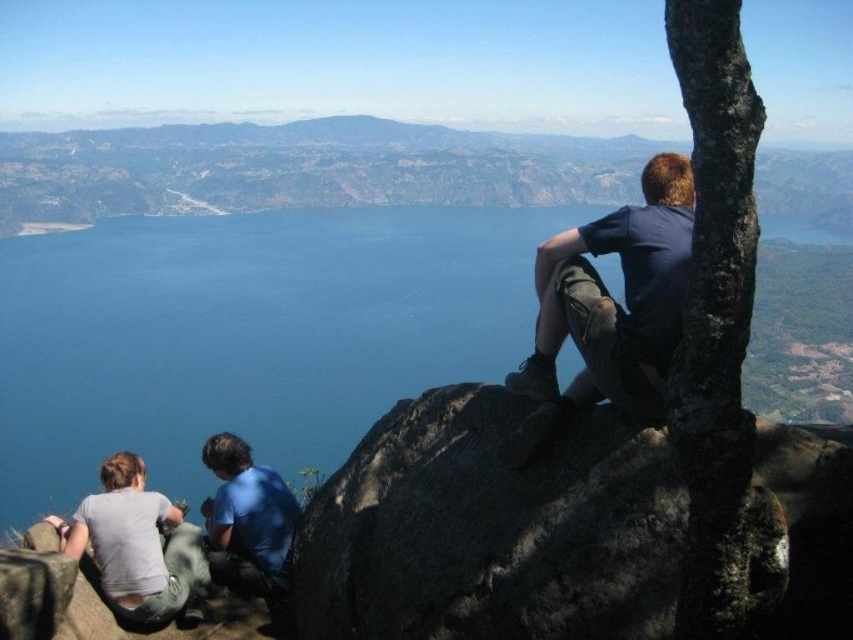
Locate an element on the screen. blue water at center is located at coordinates (245, 336).

Is blue water at center wider than light gray cotton shirt at lower left?

Indeed, blue water at center has a greater width compared to light gray cotton shirt at lower left.

Is point (808, 362) more distant than point (132, 586)?

Yes, it is.

Where is `blue water at center`? blue water at center is located at coordinates (245, 336).

Which of these two, dark blue shirt at upper right or blue matte shirt at lower left, stands shorter?

blue matte shirt at lower left is shorter.

Does dark blue shirt at upper right appear under blue matte shirt at lower left?

Actually, dark blue shirt at upper right is above blue matte shirt at lower left.

You are a GUI agent. You are given a task and a screenshot of the screen. Output one action in this format:
    pyautogui.click(x=<x>, y=<y>)
    Task: Click on the dark blue shirt at upper right
    This screenshot has height=640, width=853.
    Given the screenshot: What is the action you would take?
    pyautogui.click(x=612, y=298)

Can you confirm if dark blue shirt at upper right is wider than light gray cotton shirt at lower left?

Yes.

Which is below, dark blue shirt at upper right or light gray cotton shirt at lower left?

light gray cotton shirt at lower left

At what (x,y) coordinates should I click in order to perform the action: click on dark blue shirt at upper right. Please return your answer as a coordinate pair (x, y). Looking at the image, I should click on (612, 298).

Image resolution: width=853 pixels, height=640 pixels. In order to click on dark blue shirt at upper right in this screenshot , I will do `click(612, 298)`.